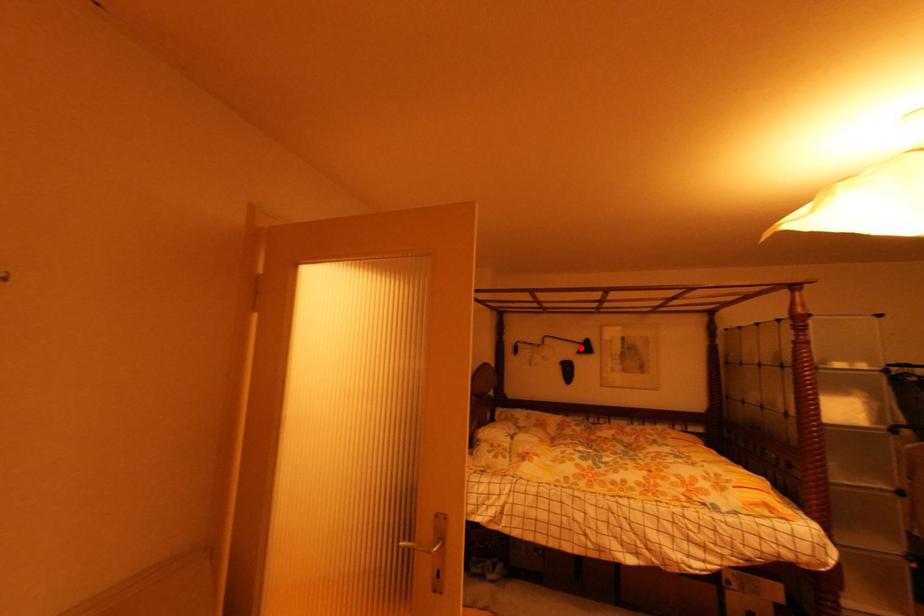
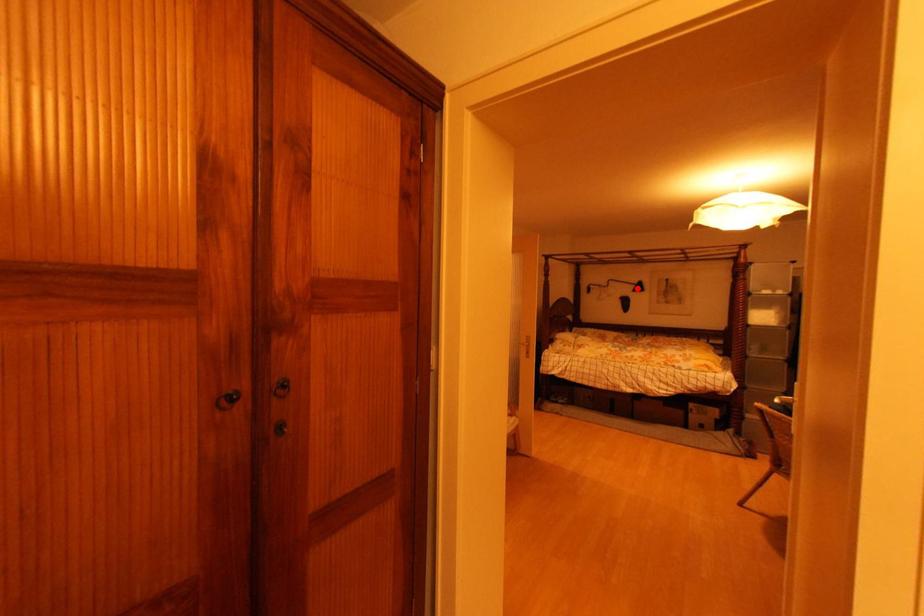
I am providing you with two images of the same scene from different viewpoints. A red point is marked on the first image and another point is marked on the second image. Is the marked point in image1 the same physical position as the marked point in image2?

Yes